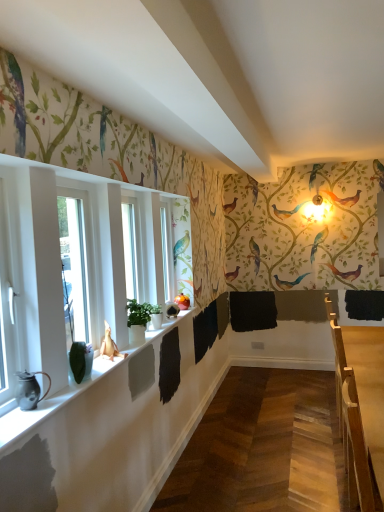
The width and height of the screenshot is (384, 512). Find the location of `vacant space to the right of white glossy window at left`. vacant space to the right of white glossy window at left is located at coordinates (41, 412).